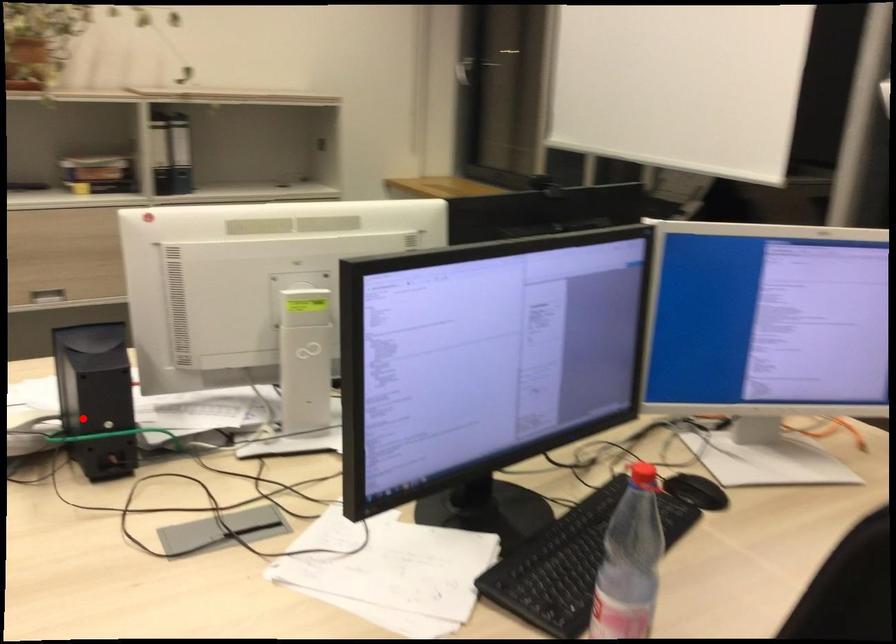
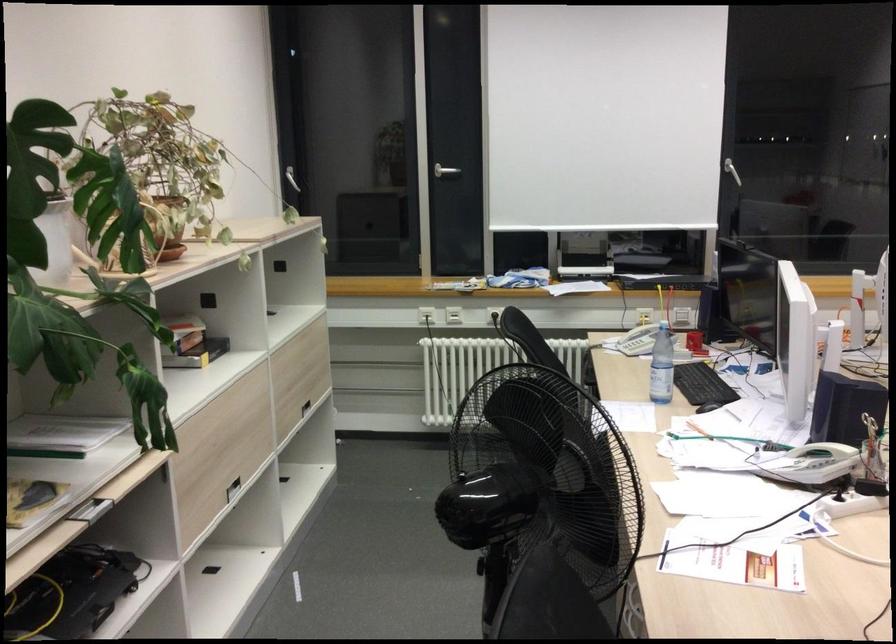
Question: I am providing you with two images of the same scene from different viewpoints. Given a red point in image1, look at the same physical point in image2. Is it:

Choices:
 (A) Closer to the viewpoint
 (B) Farther from the viewpoint

Answer: (B)